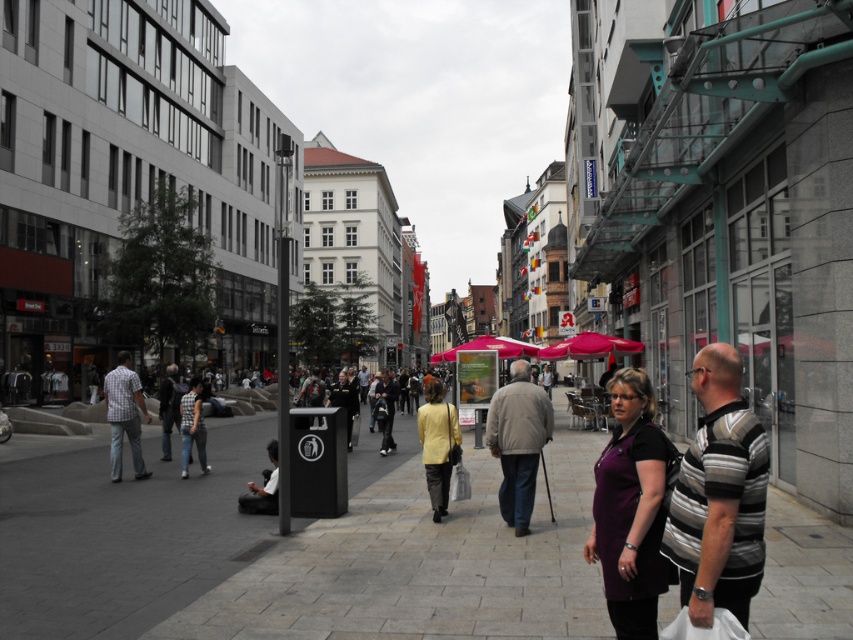
Question: Which point is farther to the camera?

Choices:
 (A) gray concrete pavement at center
 (B) light gray cotton pants at center
 (C) dark gray jeans at center

Answer: (C)

Question: Which point appears farthest from the camera in this image?

Choices:
 (A) (387, 451)
 (B) (161, 396)
 (C) (115, 401)
 (D) (502, 390)

Answer: (A)

Question: Among these points, which one is farthest from the camera?

Choices:
 (A) (654, 602)
 (B) (450, 413)
 (C) (270, 456)

Answer: (C)

Question: Does striped cotton shirt at lower right appear under dark gray jeans at center?

Choices:
 (A) yes
 (B) no

Answer: (B)

Question: Is striped shirt at center in front of dark gray jeans at center?

Choices:
 (A) yes
 (B) no

Answer: (A)

Question: Is light gray cotton pants at center thinner than dark gray jacket at center?

Choices:
 (A) yes
 (B) no

Answer: (B)